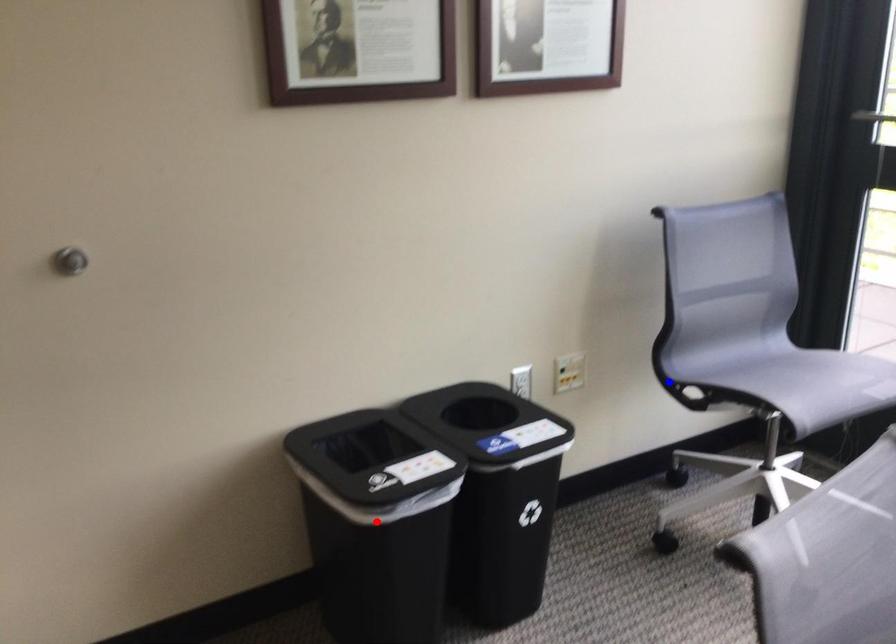
Question: Which of the two points in the image is closer to the camera?

Choices:
 (A) Blue point is closer.
 (B) Red point is closer.

Answer: (B)